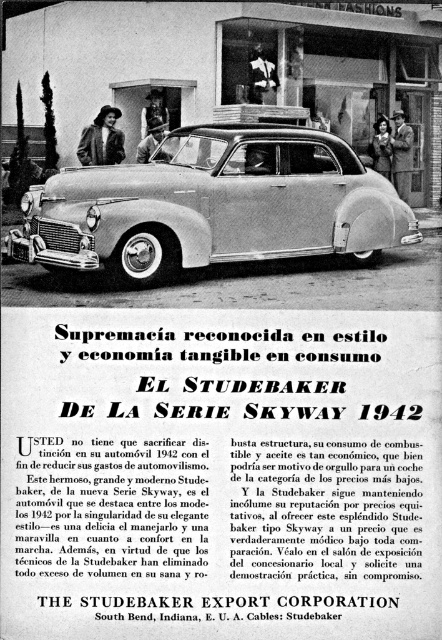
Question: Among these objects, which one is nearest to the camera?

Choices:
 (A) silver metallic sedan at center
 (B) matte black suit at center
 (C) smooth leather jacket at center

Answer: (A)

Question: Is smooth leather jacket at center positioned behind matte black suit at center?

Choices:
 (A) yes
 (B) no

Answer: (A)

Question: Is silver metallic sedan at center wider than smooth leather jacket at center?

Choices:
 (A) no
 (B) yes

Answer: (B)

Question: Is silver metallic sedan at center to the right of leather jacket at upper left from the viewer's perspective?

Choices:
 (A) no
 (B) yes

Answer: (B)

Question: Which of the following is the farthest from the observer?

Choices:
 (A) leather jacket at upper left
 (B) smooth leather jacket at center
 (C) silver metallic sedan at center
 (D) matte black suit at center

Answer: (B)

Question: Which point is farther from the camera taking this photo?

Choices:
 (A) (414, 221)
 (B) (404, 138)
 (C) (94, 147)

Answer: (B)